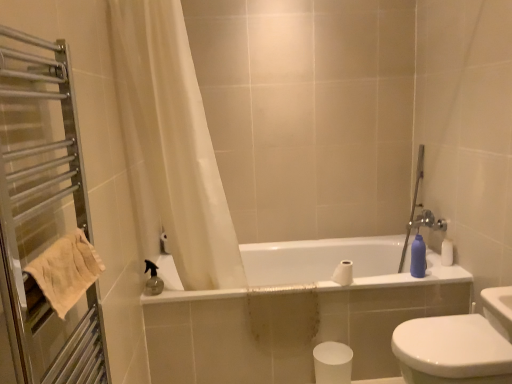
Question: From a real-world perspective, is white glossy bidet at lower right positioned above or below white sheer curtain at upper left?

Choices:
 (A) below
 (B) above

Answer: (A)

Question: From the image's perspective, is white glossy bidet at lower right located above or below white sheer curtain at upper left?

Choices:
 (A) below
 (B) above

Answer: (A)

Question: Considering the real-world distances, which object is farthest from the beige cotton towel at left?

Choices:
 (A) white matte toilet paper at center, marked as the second toilet paper in a bottom-to-top arrangement
 (B) matte plastic bottle at right
 (C) white glossy bidet at lower right
 (D) white sheer curtain at upper left
 (E) metal towel rack at left

Answer: (B)

Question: Based on their relative distances, which object is nearer to the matte plastic bottle at right?

Choices:
 (A) white matte toilet paper at lower center, the 2th toilet paper when ordered from top to bottom
 (B) white glossy bidet at lower right
 (C) white glossy bathtub at center
 (D) white matte toilet paper at center, acting as the first toilet paper starting from the top
 (E) metal towel rack at left

Answer: (D)